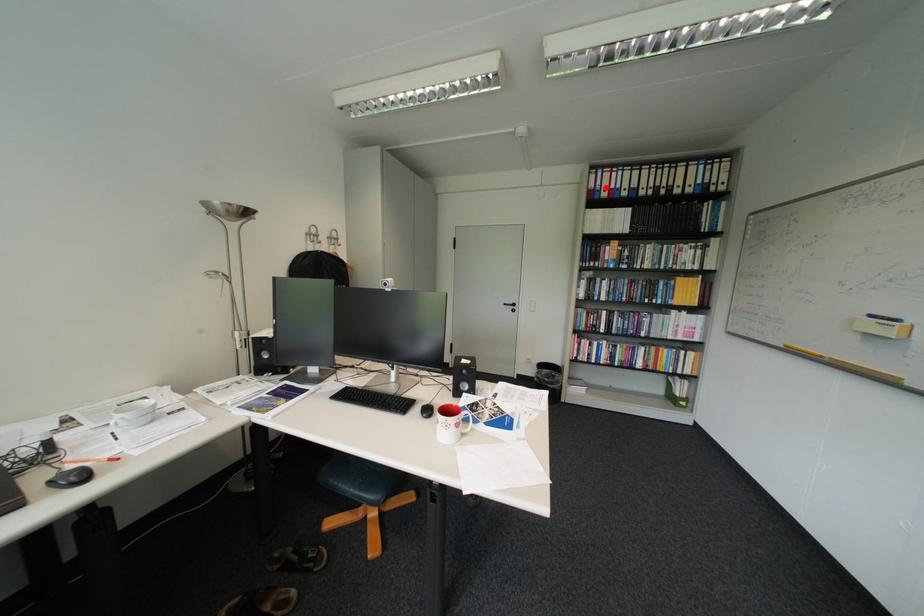
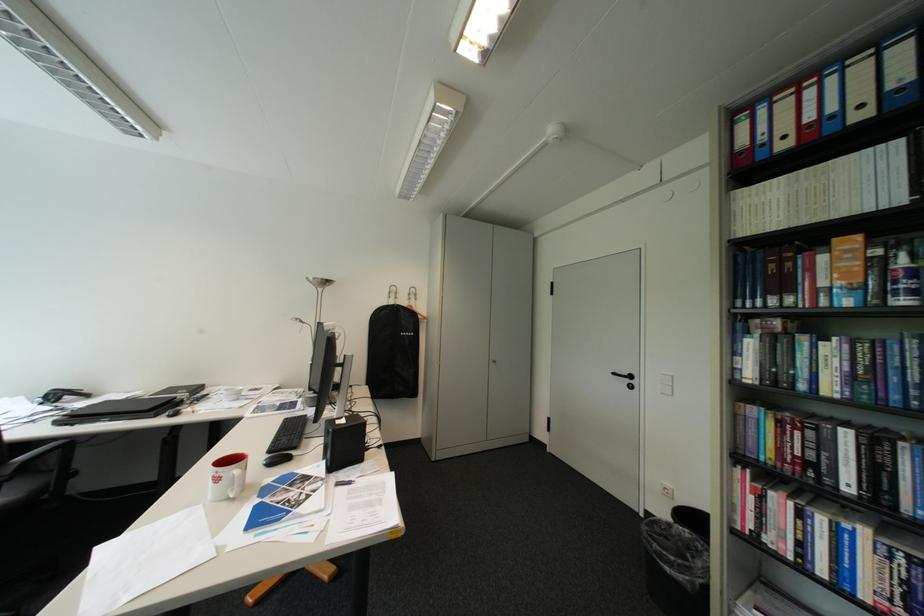
The point at the highlighted location is marked in the first image. Where is the corresponding point in the second image?

(760, 145)